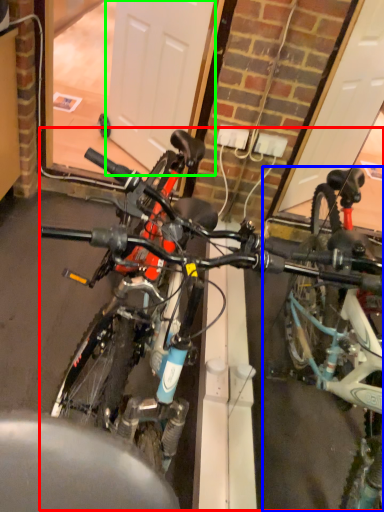
Question: Based on their relative distances, which object is nearer to bicycle (highlighted by a red box)? Choose from bicycle (highlighted by a blue box) and garage door (highlighted by a green box).

Choices:
 (A) bicycle
 (B) garage door

Answer: (A)